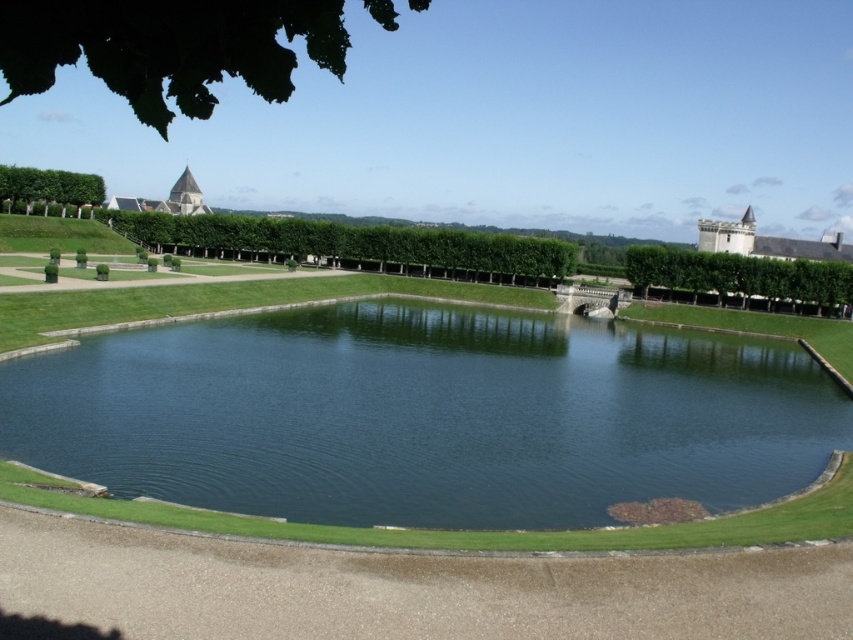
Question: Which of these objects is positioned farthest from the smooth stone tower at upper left?

Choices:
 (A) green leafy hedge at right
 (B) green leafy hedge at upper left
 (C) stone castle at right
 (D) green leafy hedge at center

Answer: (C)

Question: Can you confirm if green leafy hedge at center is positioned to the right of green leafy hedge at upper left?

Choices:
 (A) no
 (B) yes

Answer: (B)

Question: Can you confirm if green leafy hedge at center is bigger than green leafy hedge at upper left?

Choices:
 (A) no
 (B) yes

Answer: (B)

Question: Which object is positioned closest to the smooth stone tower at upper left?

Choices:
 (A) green leafy hedge at right
 (B) green leafy hedge at center
 (C) green leafy hedge at upper left
 (D) green smooth water at center

Answer: (C)

Question: Which point is farther from the camera taking this photo?

Choices:
 (A) (335, 513)
 (B) (32, 188)
 (C) (788, 253)
 (D) (444, 252)

Answer: (B)

Question: Does green leafy hedge at right come in front of green leafy hedge at upper left?

Choices:
 (A) yes
 (B) no

Answer: (A)